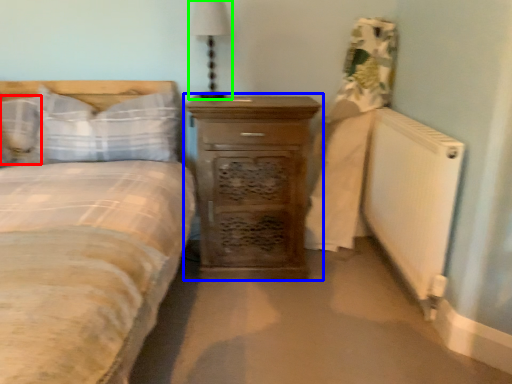
Question: Which object is the closest to the pillow (highlighted by a red box)? Choose among these: chest of drawers (highlighted by a blue box) or bedside lamp (highlighted by a green box).

Choices:
 (A) chest of drawers
 (B) bedside lamp

Answer: (B)